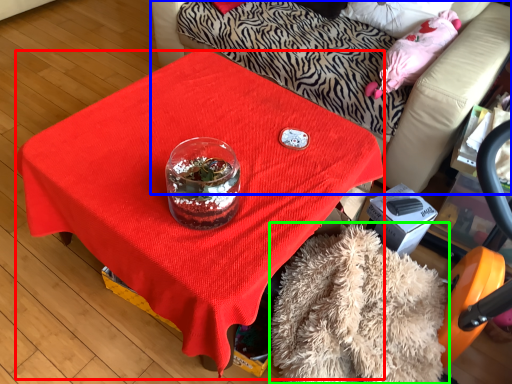
Question: Estimate the real-world distances between objects in this image. Which object is farther from desk (highlighted by a red box), furniture (highlighted by a blue box) or blanket (highlighted by a green box)?

Choices:
 (A) furniture
 (B) blanket

Answer: (A)